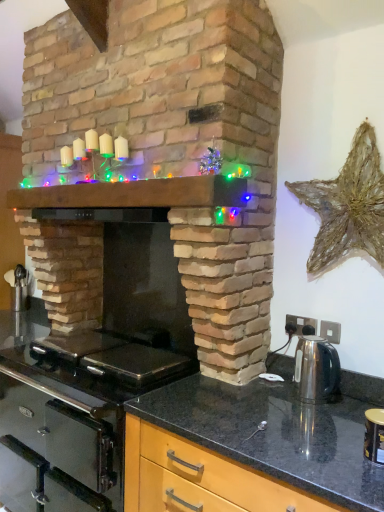
Locate an element on the screen. empty space that is ontop of matte black countertop at lower right (from a real-world perspective) is located at coordinates (292, 424).